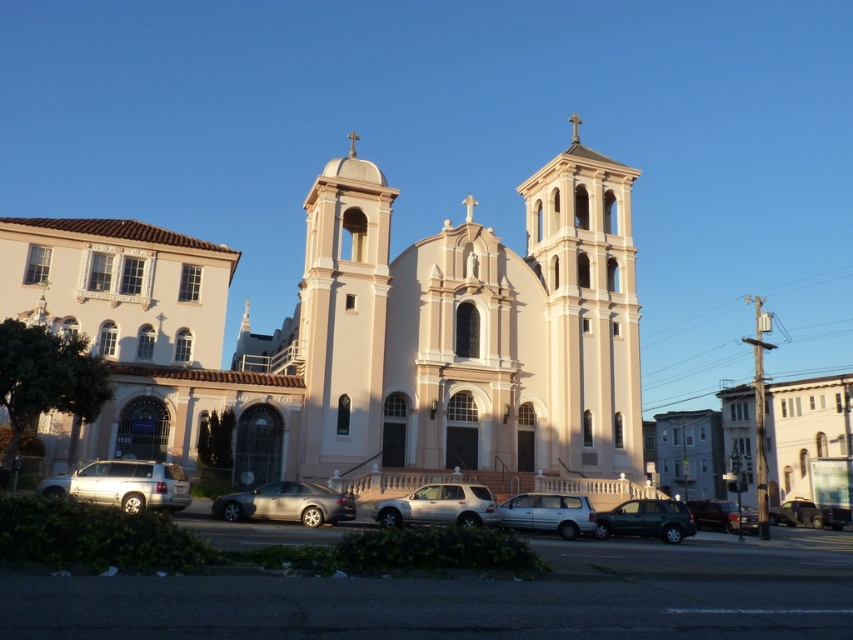
Question: Does silver metallic van at center appear on the right side of metallic maroon sedan at center?

Choices:
 (A) no
 (B) yes

Answer: (A)

Question: Which point appears farthest from the camera in this image?

Choices:
 (A) (595, 534)
 (B) (140, 506)

Answer: (A)

Question: Considering the relative positions of smooth beige church at center and satin silver sedan at center in the image provided, where is smooth beige church at center located with respect to satin silver sedan at center?

Choices:
 (A) left
 (B) right

Answer: (B)

Question: Among these points, which one is nearest to the camera?

Choices:
 (A) (599, 401)
 (B) (795, 522)
 (C) (578, 496)
 (D) (747, 515)

Answer: (C)

Question: Does silver metallic van at center have a larger size compared to metallic maroon sedan at center?

Choices:
 (A) yes
 (B) no

Answer: (B)

Question: Which point is closer to the camera?

Choices:
 (A) (817, 512)
 (B) (538, 497)
 (C) (175, 324)

Answer: (B)